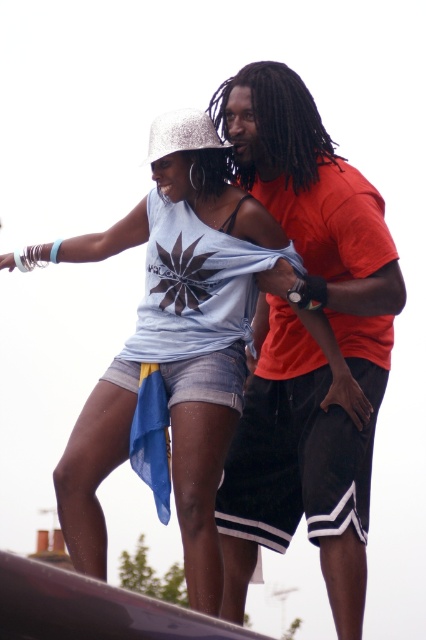
You are a photographer trying to capture a candid shot of both the orange matte shirt at upper right and the matte blue denim shorts at center. Based on their heights, which one should you focus on first to ensure both are in frame?

The orange matte shirt at upper right has a greater height compared to the matte blue denim shorts at center, so you should focus on the orange matte shirt at upper right first to ensure both are in frame.

You are taking a photo of two people standing outside. You notice two points marked in the image at coordinates point (365,378) and point (186,476). Which point is closer to the camera?

Point (365,378) is further to the camera than point (186,476), so the closer point to the camera is point (186,476).